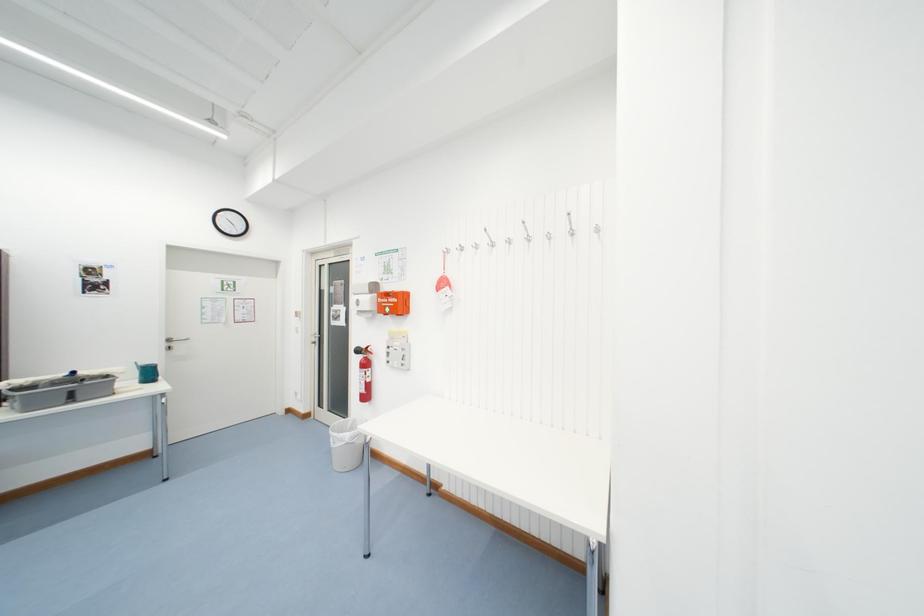
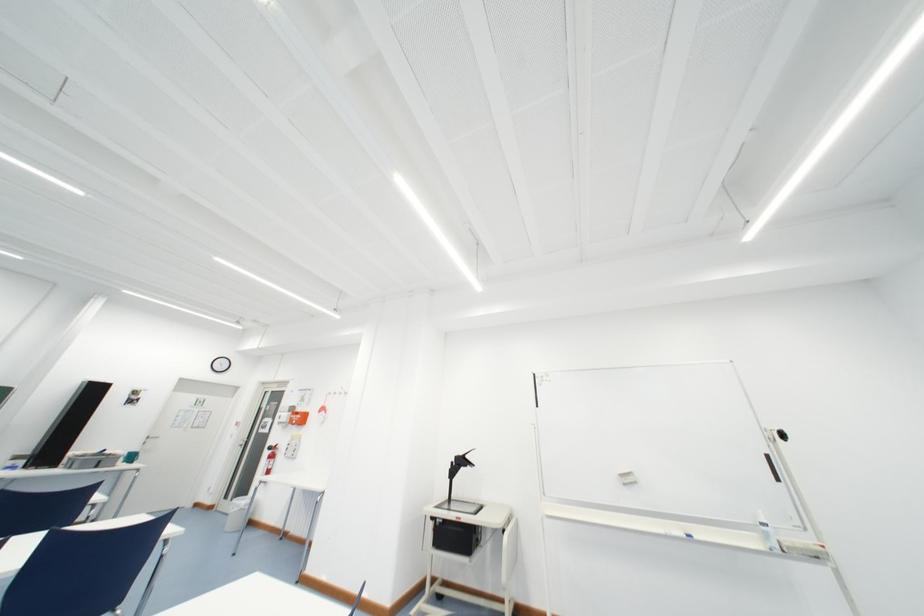
Which direction would the cameraman need to move to produce the second image?

The cameraman moved toward right, backward.